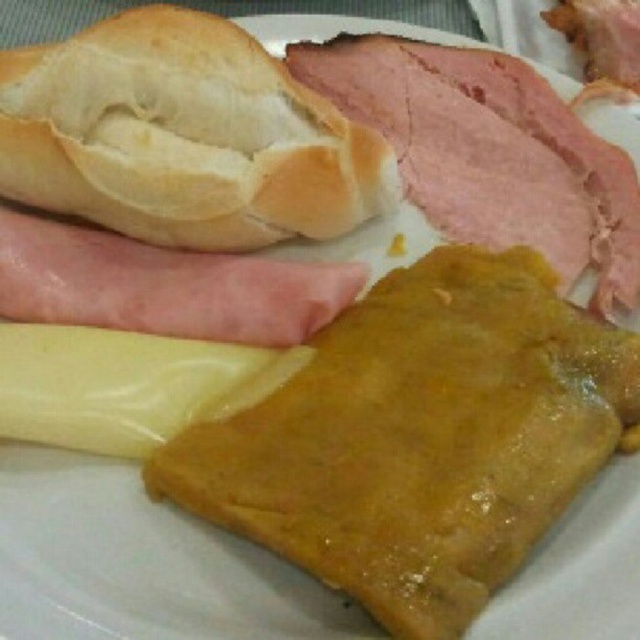
Question: Can you confirm if pink smooth ham at upper right is wider than yellowish matte cheese at center?

Choices:
 (A) yes
 (B) no

Answer: (A)

Question: Which point is closer to the camera taking this photo?

Choices:
 (A) (284, 125)
 (B) (144, 436)
 (C) (298, 260)
 (D) (467, 232)

Answer: (B)

Question: Which of the following is the farthest from the observer?

Choices:
 (A) (467, 305)
 (B) (337, 104)
 (C) (172, 435)

Answer: (B)

Question: Which is farther from the yellowish matte cheese at center?

Choices:
 (A) golden-brown flaky pastry at center
 (B) golden brown crusty bread at upper left
 (C) pink smooth ham at upper right
 (D) pink smooth ham at left

Answer: (C)

Question: Can you confirm if golden brown crusty bread at upper left is thinner than pink smooth ham at upper right?

Choices:
 (A) yes
 (B) no

Answer: (B)

Question: Is pink smooth ham at upper right to the left of yellowish matte cheese at center from the viewer's perspective?

Choices:
 (A) no
 (B) yes

Answer: (A)